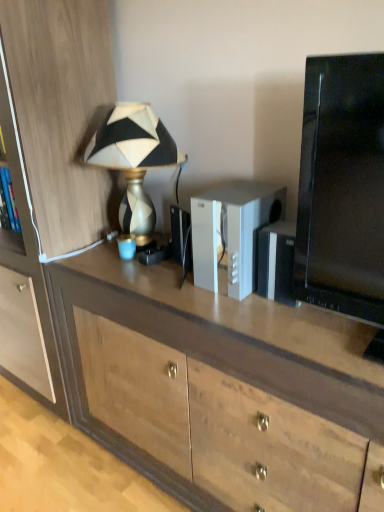
Question: Is wooden cabinet at left at the back of white plastic speaker at center?

Choices:
 (A) yes
 (B) no

Answer: (B)

Question: From a real-world perspective, is white plastic speaker at center located higher than wooden cabinet at left?

Choices:
 (A) yes
 (B) no

Answer: (A)

Question: Considering the relative sizes of white plastic speaker at center and wooden cabinet at left in the image provided, is white plastic speaker at center thinner than wooden cabinet at left?

Choices:
 (A) yes
 (B) no

Answer: (A)

Question: From the image's perspective, is white plastic speaker at center on top of wooden cabinet at left?

Choices:
 (A) yes
 (B) no

Answer: (B)

Question: Is white plastic speaker at center outside of wooden cabinet at left?

Choices:
 (A) yes
 (B) no

Answer: (A)

Question: Is wooden desk at center inside the boundaries of wooden cabinet at left, or outside?

Choices:
 (A) inside
 (B) outside

Answer: (B)

Question: From a real-world perspective, is wooden desk at center positioned above or below wooden cabinet at left?

Choices:
 (A) above
 (B) below

Answer: (B)

Question: From the image's perspective, is wooden desk at center located above or below wooden cabinet at left?

Choices:
 (A) above
 (B) below

Answer: (B)

Question: Is wooden desk at center in front of or behind wooden cabinet at left in the image?

Choices:
 (A) front
 (B) behind

Answer: (A)

Question: In terms of height, does metallic gold lamp at upper left look taller or shorter compared to wooden desk at center?

Choices:
 (A) tall
 (B) short

Answer: (B)

Question: Considering the positions of metallic gold lamp at upper left and wooden desk at center in the image, is metallic gold lamp at upper left wider or thinner than wooden desk at center?

Choices:
 (A) thin
 (B) wide

Answer: (A)

Question: From a real-world perspective, is metallic gold lamp at upper left physically located above or below wooden desk at center?

Choices:
 (A) below
 (B) above

Answer: (B)

Question: Is metallic gold lamp at upper left inside or outside of wooden desk at center?

Choices:
 (A) outside
 (B) inside

Answer: (A)

Question: Considering the positions of white plastic speaker at center and wooden desk at center in the image, is white plastic speaker at center bigger or smaller than wooden desk at center?

Choices:
 (A) big
 (B) small

Answer: (B)

Question: From the image's perspective, is white plastic speaker at center above or below wooden desk at center?

Choices:
 (A) below
 (B) above

Answer: (B)